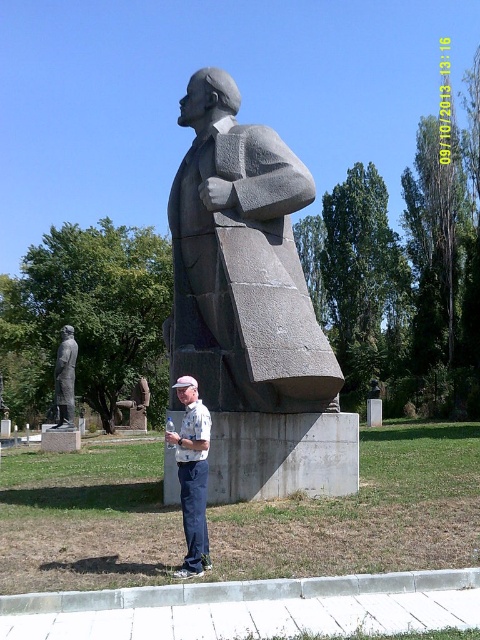
Looking at this image, who is shorter, gray stone bust at center or polished bronze statue at lower left?

polished bronze statue at lower left is shorter.

Can you confirm if gray stone bust at center is positioned above polished bronze statue at lower left?

Yes, gray stone bust at center is above polished bronze statue at lower left.

Describe the element at coordinates (241, 262) in the screenshot. I see `gray stone bust at center` at that location.

Locate an element on the screen. gray stone bust at center is located at coordinates (241, 262).

Does point (245, 262) come behind point (188, 509)?

Yes, it is behind point (188, 509).

Does point (177, 337) lie behind point (182, 435)?

Yes, it is.

Where is `gray stone bust at center`? This screenshot has width=480, height=640. gray stone bust at center is located at coordinates (241, 262).

Locate an element on the screen. Image resolution: width=480 pixels, height=640 pixels. white cotton shirt at center is located at coordinates (192, 476).

The image size is (480, 640). Find the location of `white cotton shirt at center`. white cotton shirt at center is located at coordinates (192, 476).